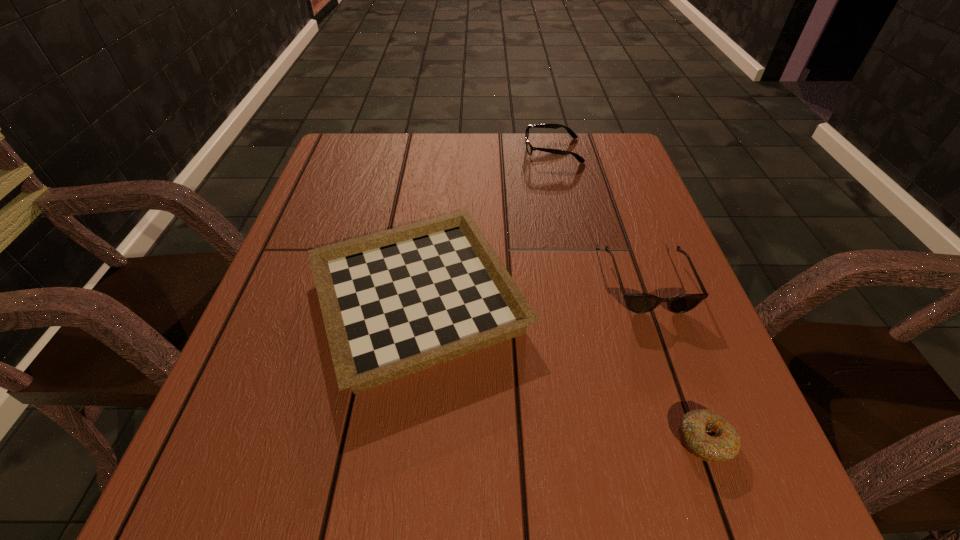
Identify the location of sunglasses. (638, 303).

Find the location of a particular element. The width and height of the screenshot is (960, 540). checkerboard is located at coordinates (395, 302).

The image size is (960, 540). Identify the location of spectacles. (529, 147).

Locate an element on the screen. the shortest object is located at coordinates (707, 435).

Locate an element on the screen. The width and height of the screenshot is (960, 540). the nearest object is located at coordinates (707, 435).

Where is `free space located on the front lenses of the sunglasses`? The image size is (960, 540). free space located on the front lenses of the sunglasses is located at coordinates (710, 455).

The image size is (960, 540). Find the location of `free space located 0.070m on the left of the leftmost object`. free space located 0.070m on the left of the leftmost object is located at coordinates tap(265, 299).

You are a GUI agent. You are given a task and a screenshot of the screen. Output one action in this format:
    pyautogui.click(x=<x>, y=<y>)
    Task: Click on the vacant region located 0.170m on the front-facing side of the spectacles
    
    Given the screenshot: What is the action you would take?
    pyautogui.click(x=463, y=150)

I want to click on vacant space located on the front-facing side of the spectacles, so click(492, 150).

Where is `vacant space situated 0.150m on the front-facing side of the spectacles`? vacant space situated 0.150m on the front-facing side of the spectacles is located at coordinates 469,150.